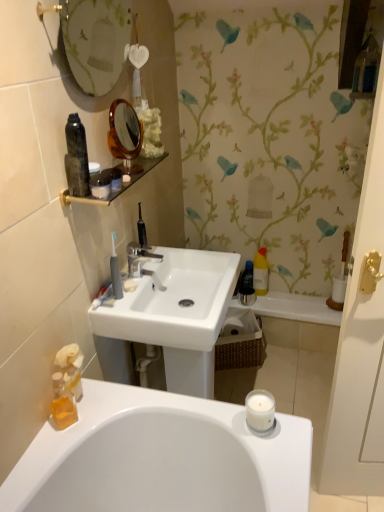
Where is `vacant space to the right of yellow translucent bottle at right, marked as the 3th bottle in a left-to-right arrangement`? This screenshot has height=512, width=384. vacant space to the right of yellow translucent bottle at right, marked as the 3th bottle in a left-to-right arrangement is located at coordinates (294, 296).